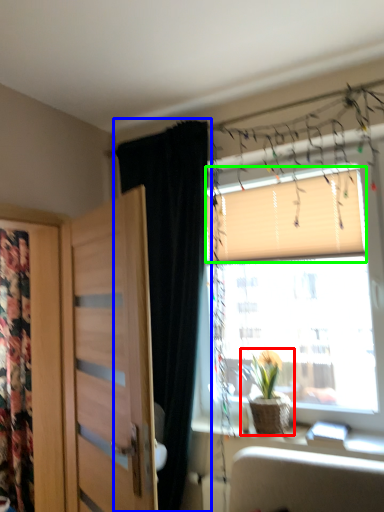
Question: Considering the real-world distances, which object is closest to houseplant (highlighted by a red box)? curtain (highlighted by a blue box) or blind (highlighted by a green box).

Choices:
 (A) curtain
 (B) blind

Answer: (A)